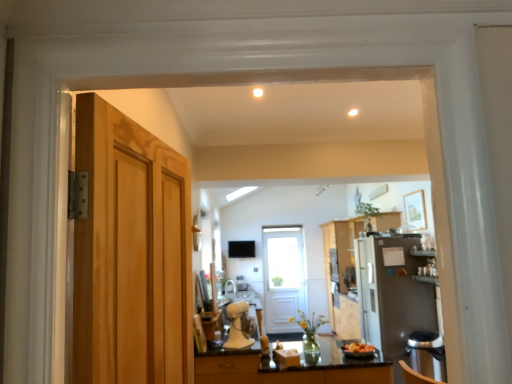
Question: Should I look upward or downward to see black marble countertop at lower center?

Choices:
 (A) down
 (B) up

Answer: (A)

Question: Is light brown wood door at left, marked as the first door in a top-to-bottom arrangement, positioned behind satin silver refrigerator at right, which is counted as the 1th appliance, starting from the right?

Choices:
 (A) yes
 (B) no

Answer: (B)

Question: Is light brown wood door at left, marked as the first door in a top-to-bottom arrangement, turned away from satin silver refrigerator at right, placed as the first appliance when sorted from back to front?

Choices:
 (A) yes
 (B) no

Answer: (B)

Question: Can you confirm if light brown wood door at left, marked as the first door in a top-to-bottom arrangement, is taller than satin silver refrigerator at right, placed as the 2th appliance when sorted from front to back?

Choices:
 (A) yes
 (B) no

Answer: (B)

Question: Is light brown wood door at left, the first door from the left, next to satin silver refrigerator at right, which is counted as the 1th appliance, starting from the right, and touching it?

Choices:
 (A) no
 (B) yes

Answer: (A)

Question: Is light brown wood door at left, marked as the first door in a top-to-bottom arrangement, outside of satin silver refrigerator at right, which is counted as the second appliance, starting from the left?

Choices:
 (A) yes
 (B) no

Answer: (A)

Question: From the image's perspective, is light brown wood door at left, which appears as the 2th door when viewed from the right, on top of satin silver refrigerator at right, which is counted as the 1th appliance, starting from the right?

Choices:
 (A) yes
 (B) no

Answer: (A)

Question: Is multicolored plastic bowl at center smaller than black marble countertop at lower center?

Choices:
 (A) yes
 (B) no

Answer: (A)

Question: Is multicolored plastic bowl at center positioned before black marble countertop at lower center?

Choices:
 (A) yes
 (B) no

Answer: (B)

Question: Considering the relative positions of multicolored plastic bowl at center and black marble countertop at lower center in the image provided, is multicolored plastic bowl at center to the left of black marble countertop at lower center from the viewer's perspective?

Choices:
 (A) no
 (B) yes

Answer: (A)

Question: Is multicolored plastic bowl at center directly adjacent to black marble countertop at lower center?

Choices:
 (A) no
 (B) yes

Answer: (A)

Question: Does multicolored plastic bowl at center have a greater width compared to black marble countertop at lower center?

Choices:
 (A) yes
 (B) no

Answer: (B)

Question: Is multicolored plastic bowl at center outside of black marble countertop at lower center?

Choices:
 (A) no
 (B) yes

Answer: (B)

Question: From the image's perspective, would you say multicolored plastic bowl at center is positioned over wooden cabinet at center?

Choices:
 (A) yes
 (B) no

Answer: (A)